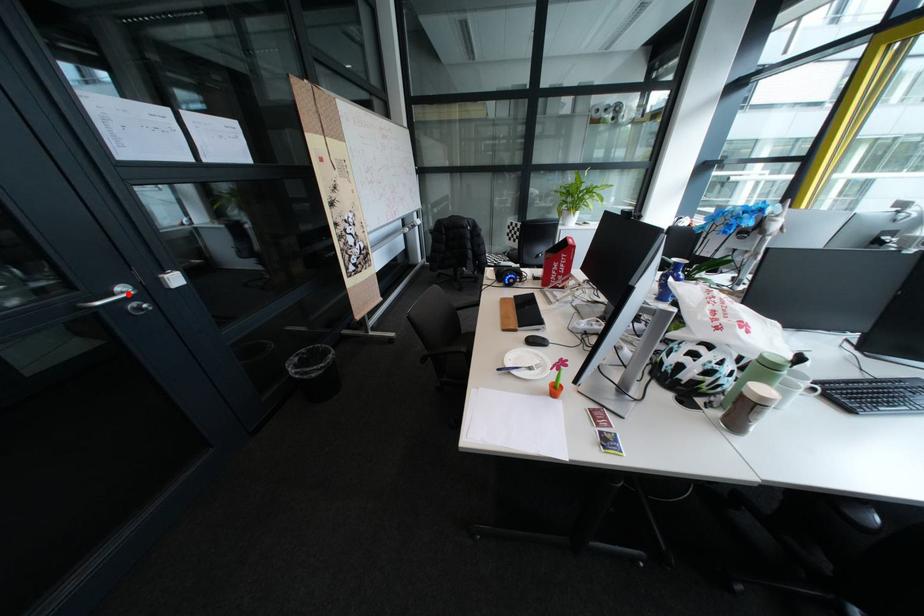
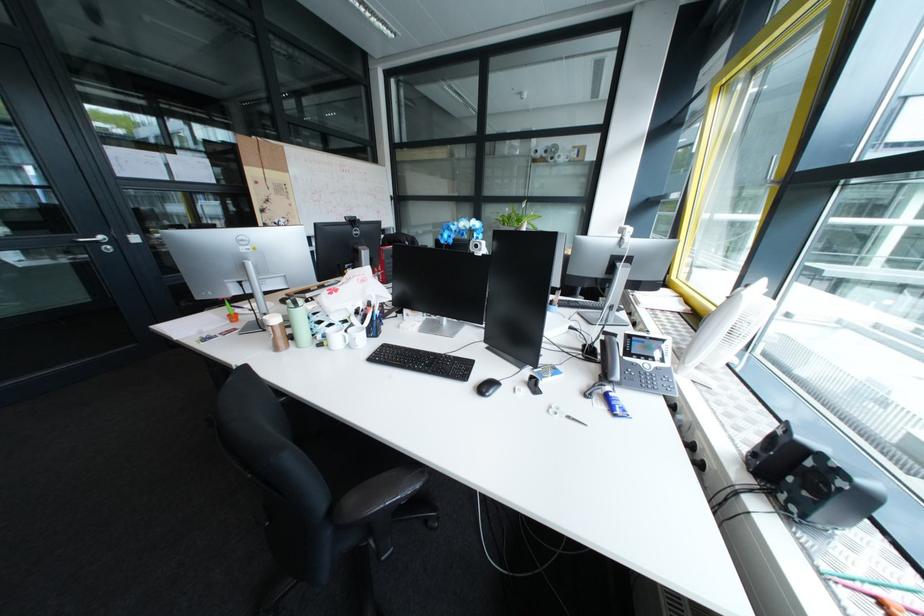
In the second image, find the point that corresponds to the highlighted location in the first image.

(107, 238)